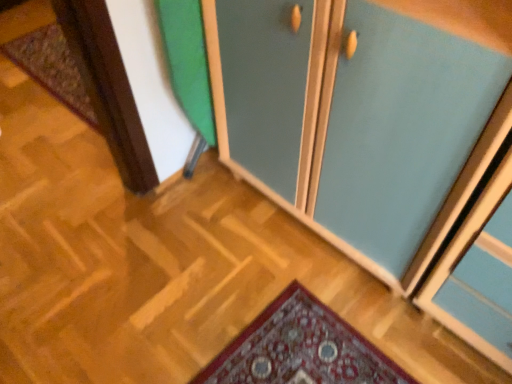
The width and height of the screenshot is (512, 384). What do you see at coordinates (362, 116) in the screenshot? I see `teal matte cabinet at center` at bounding box center [362, 116].

Measure the distance between point (380, 138) and camera.

38.07 inches.

You are a GUI agent. You are given a task and a screenshot of the screen. Output one action in this format:
    pyautogui.click(x=<x>, y=<y>)
    Task: Click on the teal matte cabinet at center
    This screenshot has width=512, height=384.
    Given the screenshot: What is the action you would take?
    pyautogui.click(x=362, y=116)

What do you see at coordinates (52, 68) in the screenshot? I see `carpeted mat at left` at bounding box center [52, 68].

From the picture: Measure the distance between point [53,82] and camera.

Point [53,82] is 6.82 feet away from camera.

In order to face carpeted mat at left, should I rotate leftwards or rightwards?

A 23.029 degree turn to the left will do.

Where is `carpeted mat at left`? carpeted mat at left is located at coordinates (52, 68).

Find the location of a particular element. The width and height of the screenshot is (512, 384). teal matte cabinet at center is located at coordinates (362, 116).

Which object is positioned more to the right, carpeted mat at left or teal matte cabinet at center?

teal matte cabinet at center.

Is the depth of carpeted mat at left greater than that of teal matte cabinet at center?

Yes, carpeted mat at left is further from the camera.

Which is further, (19, 43) or (240, 137)?

The point (19, 43) is farther.

From the image's perspective, which is below, carpeted mat at left or teal matte cabinet at center?

teal matte cabinet at center is shown below in the image.

From a real-world perspective, does carpeted mat at left stand above teal matte cabinet at center?

Actually, carpeted mat at left is physically below teal matte cabinet at center in the real world.

Does carpeted mat at left have a greater width compared to teal matte cabinet at center?

Incorrect, the width of carpeted mat at left does not surpass that of teal matte cabinet at center.

Who is taller, carpeted mat at left or teal matte cabinet at center?

With more height is teal matte cabinet at center.

Consider the image. Based on their sizes in the image, would you say carpeted mat at left is bigger or smaller than teal matte cabinet at center?

Considering their sizes, carpeted mat at left takes up less space than teal matte cabinet at center.

Does carpeted mat at left contain teal matte cabinet at center?

No, carpeted mat at left does not contain teal matte cabinet at center.

Consider the image. Would you say carpeted mat at left is a long distance from teal matte cabinet at center?

That's right, there is a large distance between carpeted mat at left and teal matte cabinet at center.

Is carpeted mat at left oriented away from teal matte cabinet at center?

carpeted mat at left is not turned away from teal matte cabinet at center.

Looking at this image, how distant is carpeted mat at left from teal matte cabinet at center?

The distance of carpeted mat at left from teal matte cabinet at center is 4.01 feet.

Locate an element on the screen. cupboard located below the carpeted mat at left (from the image's perspective) is located at coordinates (362, 116).

Is teal matte cabinet at center at the right side of carpeted mat at left?

Yes, teal matte cabinet at center is to the right of carpeted mat at left.

Considering their positions, is teal matte cabinet at center located in front of or behind carpeted mat at left?

Visually, teal matte cabinet at center is located in front of carpeted mat at left.

Between point (404, 200) and point (54, 82), which one is positioned in front?

The point (404, 200) is in front.

From the image's perspective, relative to carpeted mat at left, is teal matte cabinet at center above or below?

teal matte cabinet at center is situated lower than carpeted mat at left in the image.

From a real-world perspective, is teal matte cabinet at center physically below carpeted mat at left?

No, from a real-world perspective, teal matte cabinet at center is not below carpeted mat at left.

In terms of width, does teal matte cabinet at center look wider or thinner when compared to carpeted mat at left?

Considering their sizes, teal matte cabinet at center looks broader than carpeted mat at left.

From their relative heights in the image, would you say teal matte cabinet at center is taller or shorter than carpeted mat at left?

In the image, teal matte cabinet at center appears to be taller than carpeted mat at left.

Considering the relative sizes of teal matte cabinet at center and carpeted mat at left in the image provided, is teal matte cabinet at center smaller than carpeted mat at left?

Actually, teal matte cabinet at center might be larger than carpeted mat at left.

Is teal matte cabinet at center located outside carpeted mat at left?

Indeed, teal matte cabinet at center is completely outside carpeted mat at left.

Is teal matte cabinet at center placed right next to carpeted mat at left?

teal matte cabinet at center is not next to carpeted mat at left, and they're not touching.

Is teal matte cabinet at center turned away from carpeted mat at left?

No, teal matte cabinet at center is not facing away from carpeted mat at left.

From the picture: How different are the orientations of teal matte cabinet at center and carpeted mat at left in degrees?

The angle between the facing direction of teal matte cabinet at center and the facing direction of carpeted mat at left is 2.35 degrees.

How much distance is there between teal matte cabinet at center and carpeted mat at left?

teal matte cabinet at center and carpeted mat at left are 4.01 feet apart from each other.

What are the coordinates of `cupboard lying on the right of carpeted mat at left` in the screenshot? It's located at (362, 116).

Identify the location of mat above the teal matte cabinet at center (from the image's perspective). The width and height of the screenshot is (512, 384). (52, 68).

Locate an element on the screen. The image size is (512, 384). cupboard to the right of carpeted mat at left is located at coordinates (362, 116).